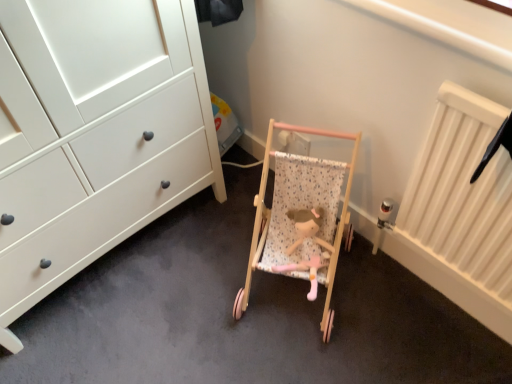
Question: Is wooden stroller at center to the left or to the right of wooden doll at center in the image?

Choices:
 (A) right
 (B) left

Answer: (B)

Question: From a real-world perspective, is wooden stroller at center above or below wooden doll at center?

Choices:
 (A) above
 (B) below

Answer: (A)

Question: In terms of width, does wooden stroller at center look wider or thinner when compared to wooden doll at center?

Choices:
 (A) thin
 (B) wide

Answer: (B)

Question: Choose the correct answer: Is wooden doll at center inside wooden stroller at center or outside it?

Choices:
 (A) outside
 (B) inside

Answer: (B)

Question: Is wooden doll at center taller or shorter than wooden stroller at center?

Choices:
 (A) tall
 (B) short

Answer: (B)

Question: Is wooden doll at center wider or thinner than wooden stroller at center?

Choices:
 (A) thin
 (B) wide

Answer: (A)

Question: From a real-world perspective, is wooden doll at center above or below wooden stroller at center?

Choices:
 (A) above
 (B) below

Answer: (B)